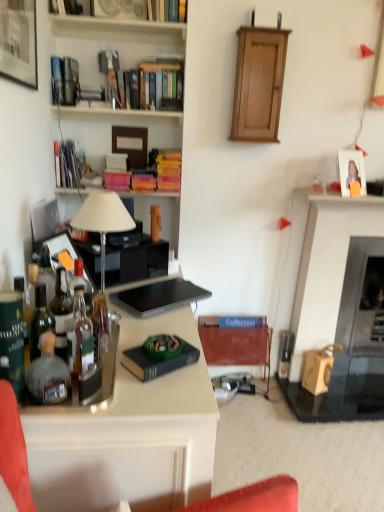
Question: Is wooden fireplace at right wider or thinner than matte black picture frame at upper left, positioned as the 1th picture frame in top-to-bottom order?

Choices:
 (A) wide
 (B) thin

Answer: (A)

Question: In terms of size, does wooden fireplace at right appear bigger or smaller than matte black picture frame at upper left, which is counted as the 1th picture frame, starting from the front?

Choices:
 (A) big
 (B) small

Answer: (A)

Question: Which object is positioned farthest from the blue hardcover book at center, which is the 7th book from top to bottom?

Choices:
 (A) blue hardcover book at center, which is the first book in bottom-to-top order
 (B) black matte laptop at center
 (C) matte black picture frame at upper left, positioned as the 1th picture frame in top-to-bottom order
 (D) translucent glass bottles at left, the third bottle when ordered from front to back
 (E) hardcover book at upper center, marked as the eighth book in a bottom-to-top arrangement

Answer: (E)

Question: Considering the real-world distances, which object is closest to the wooden fireplace at right?

Choices:
 (A) white glossy desk at lower left
 (B) hardcover book at upper left, the fourth book when ordered from top to bottom
 (C) yellow matte book at center, acting as the fourth book starting from the bottom
 (D) hardcover books at upper center, which ranks as the second shelf in bottom-to-top order
 (E) translucent glass bottles at left, the third bottle when ordered from front to back

Answer: (C)